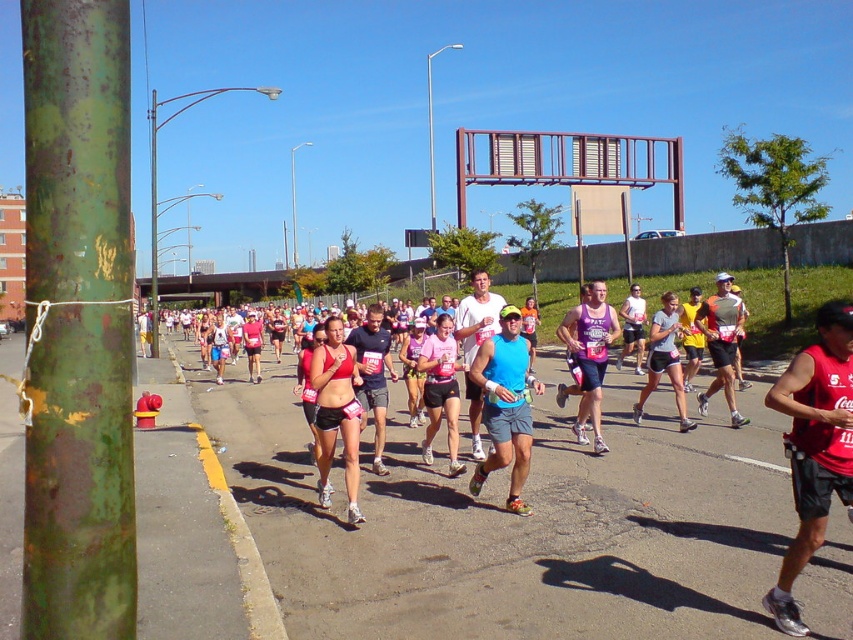
Question: Which object is positioned closest to the matte red sports bra at center?

Choices:
 (A) green rusted pole at left
 (B) red fabric tank top at center-right

Answer: (A)

Question: In this image, where is green rusted pole at left located relative to red fabric tank top at center-right?

Choices:
 (A) left
 (B) right

Answer: (A)

Question: Which object is the farthest from the matte red sports bra at center?

Choices:
 (A) green rusted pole at left
 (B) red fabric tank top at center-right

Answer: (B)

Question: Which object appears closest to the camera in this image?

Choices:
 (A) red fabric tank top at center-right
 (B) matte red sports bra at center

Answer: (A)

Question: Does red fabric tank top at center-right appear on the right side of matte red sports bra at center?

Choices:
 (A) yes
 (B) no

Answer: (A)

Question: Does red fabric tank top at center-right appear under matte red sports bra at center?

Choices:
 (A) yes
 (B) no

Answer: (B)